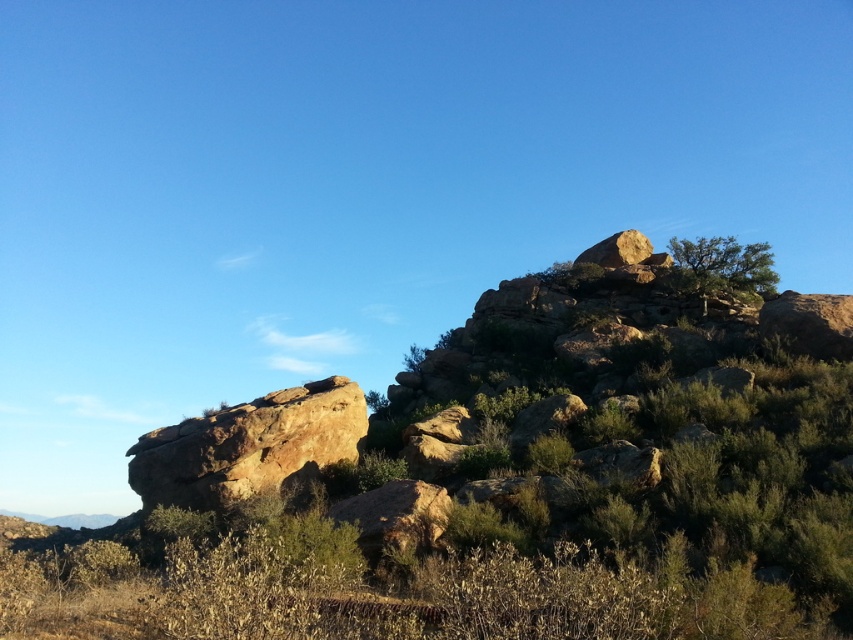
Question: Can you confirm if brown rough rock at center is positioned to the right of rustic brown rock at upper right?

Choices:
 (A) yes
 (B) no

Answer: (B)

Question: Is brown rough rock at center thinner than rustic brown rock at upper right?

Choices:
 (A) no
 (B) yes

Answer: (A)

Question: From the image, what is the correct spatial relationship of brown rough rock at center in relation to rustic brown rock at upper right?

Choices:
 (A) right
 (B) left

Answer: (B)